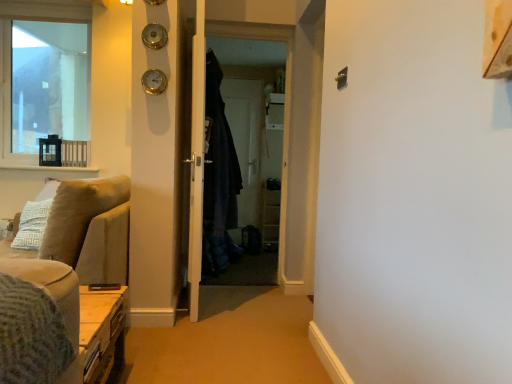
At what (x,y) coordinates should I click in order to perform the action: click on vacant area on top of dark fabric screen door at center, which appears as the first screen door when viewed from the front (from a real-world perspective). Please return your answer as a coordinate pair (x, y). Looking at the image, I should click on (247, 16).